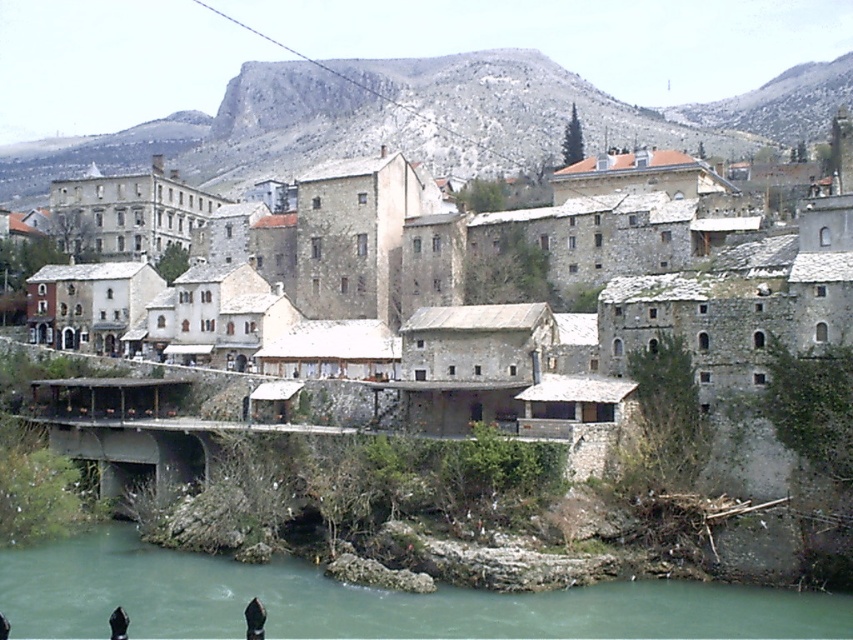
You are an architect planning to build a new pathway in the historic town. The pathway must be wide enough to accommodate a 3.5 meter wide cart. Given the snowy rocky hillside at upper center and the green stone river at lower center, which of these two features can the pathway be built along without exceeding the width requirement?

The snowy rocky hillside at upper center has a greater width than the green stone river at lower center. Since the pathway must be at least 3.5 meters wide, the snowy rocky hillside at upper center can accommodate the pathway, while the green stone river at lower center may be too narrow.

You are standing at point (662, 604) and want to walk to the historic town in the background. Is the point (627, 134) located between you and the town?

Yes, point (627, 134) is located between you and the historic town because it is behind point (662, 604) where you are standing.

You are a traveler wanting to cross the river to reach the historic town. The stone bridge at center and the green stone river at lower center are in your path. Which one should you go over or under?

You should go over the stone bridge at center to cross the river since it is positioned above the green stone river at lower center, allowing safe passage.